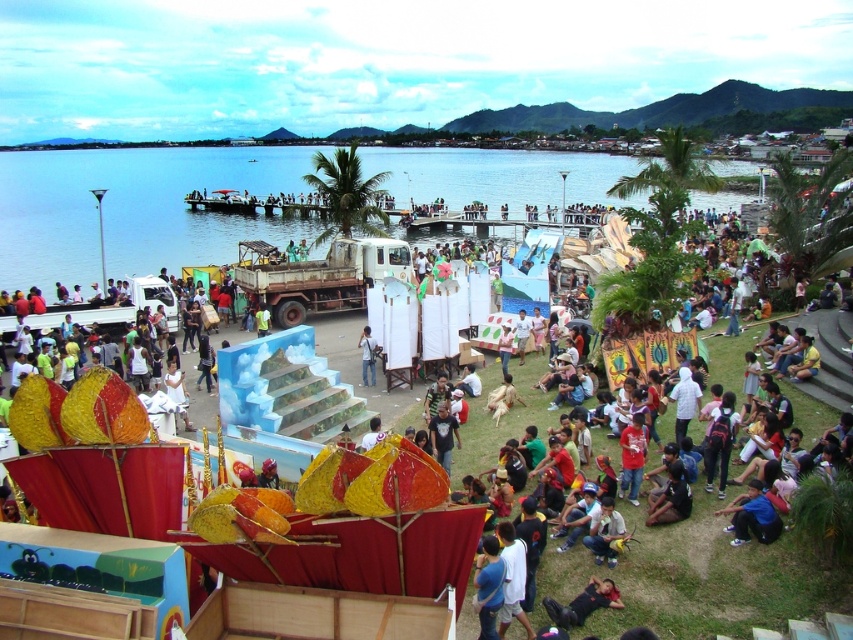
You are a photographer standing at the edge of the waterfront, wanting to capture a photo of the black fabric person at lower center and the light blue fabric at center in the same frame. Given that your camera has a maximum focal length of 50 meters, will you be able to include both objects in your shot?

The black fabric person at lower center is 21.09 meters from the light blue fabric at center. Since the distance between them is within the camera maximum focal length of 50 meters, you can include both objects in your shot.

You are organizing a community event and need to place a 3m wide banner between the blue water at center and the light blue fabric at center. Can the space between them accommodate the banner?

The blue water at center is wider than the light blue fabric at center. However, the description only states their widths relative to each other but does not provide exact measurements. Without knowing the actual width of the space between them, it is impossible to determine if the 3m wide banner will fit.